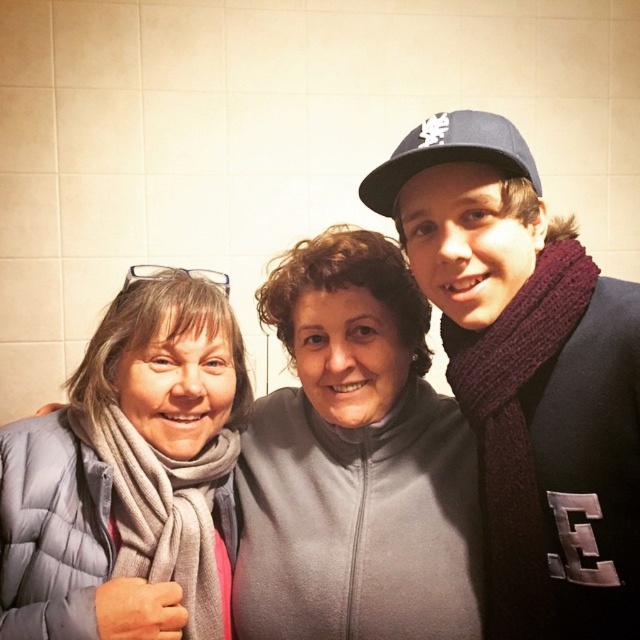
Question: Which of these objects is positioned closest to the knitted dark red scarf at right?

Choices:
 (A) gray quilted jacket at center
 (B) gray quilted jacket at left

Answer: (A)

Question: Which is farther from the gray quilted jacket at left?

Choices:
 (A) knitted dark red scarf at right
 (B) gray quilted jacket at center

Answer: (A)

Question: Is gray quilted jacket at center closer to camera compared to gray quilted jacket at left?

Choices:
 (A) yes
 (B) no

Answer: (B)

Question: Can you confirm if knitted dark red scarf at right is wider than gray quilted jacket at left?

Choices:
 (A) no
 (B) yes

Answer: (A)

Question: Can you confirm if knitted dark red scarf at right is positioned to the left of gray quilted jacket at center?

Choices:
 (A) no
 (B) yes

Answer: (A)

Question: Which point appears closest to the camera in this image?

Choices:
 (A) (6, 481)
 (B) (432, 554)
 (C) (401, 189)

Answer: (A)